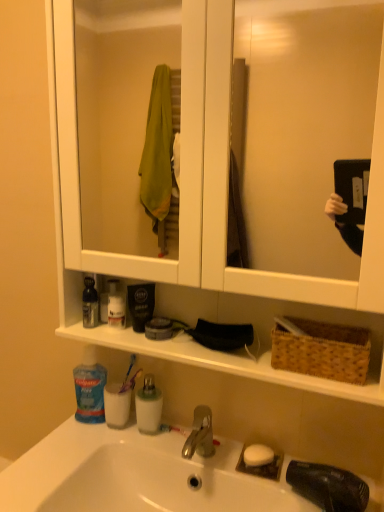
Question: Considering the relative positions of white opaque cup at lower left, the first mouthwash from the bottom, and brown woven basket at right in the image provided, is white opaque cup at lower left, the first mouthwash from the bottom, to the right of brown woven basket at right from the viewer's perspective?

Choices:
 (A) yes
 (B) no

Answer: (B)

Question: Is white opaque cup at lower left, acting as the 2th mouthwash starting from the top, shorter than brown woven basket at right?

Choices:
 (A) yes
 (B) no

Answer: (B)

Question: Can you confirm if white opaque cup at lower left, acting as the 2th mouthwash starting from the top, is taller than brown woven basket at right?

Choices:
 (A) no
 (B) yes

Answer: (B)

Question: Could brown woven basket at right be considered to be inside white opaque cup at lower left, the first mouthwash from the bottom?

Choices:
 (A) no
 (B) yes

Answer: (A)

Question: Are white opaque cup at lower left, the first mouthwash from the bottom, and brown woven basket at right located far from each other?

Choices:
 (A) no
 (B) yes

Answer: (A)

Question: Based on their positions, is clear plastic container at center located to the left or right of white matte soap at center?

Choices:
 (A) left
 (B) right

Answer: (A)

Question: From the image's perspective, is clear plastic container at center above or below white matte soap at center?

Choices:
 (A) above
 (B) below

Answer: (A)

Question: Is clear plastic container at center inside or outside of white matte soap at center?

Choices:
 (A) inside
 (B) outside

Answer: (B)

Question: Considering the positions of clear plastic container at center and white matte soap at center in the image, is clear plastic container at center wider or thinner than white matte soap at center?

Choices:
 (A) wide
 (B) thin

Answer: (A)

Question: Considering their positions, is clear plastic container at center located in front of or behind purple plastic toothbrush at lower center?

Choices:
 (A) front
 (B) behind

Answer: (A)

Question: Looking at their shapes, would you say clear plastic container at center is wider or thinner than purple plastic toothbrush at lower center?

Choices:
 (A) wide
 (B) thin

Answer: (A)

Question: Based on their positions, is clear plastic container at center located to the left or right of purple plastic toothbrush at lower center?

Choices:
 (A) left
 (B) right

Answer: (B)

Question: From the image's perspective, is clear plastic container at center above or below purple plastic toothbrush at lower center?

Choices:
 (A) below
 (B) above

Answer: (A)

Question: In terms of size, does white glossy sink at lower center appear bigger or smaller than brown woven basket at right?

Choices:
 (A) small
 (B) big

Answer: (B)

Question: From the image's perspective, relative to brown woven basket at right, is white glossy sink at lower center above or below?

Choices:
 (A) below
 (B) above

Answer: (A)